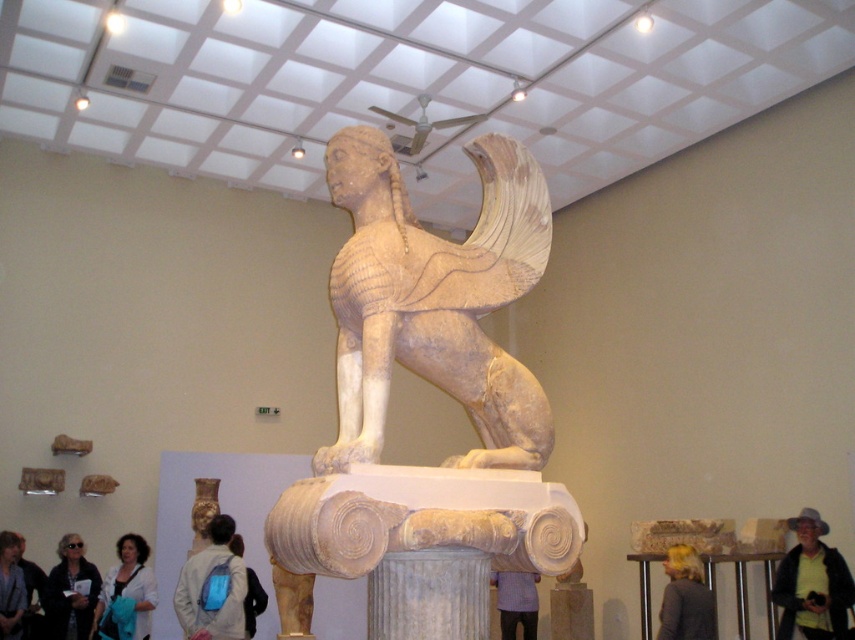
You are a visitor in the museum and notice two shirts in the image. The matte white shirt at lower left and the purple fabric shirt at center. Which shirt is covering part of the other?

The matte white shirt at lower left is positioned over the purple fabric shirt at center, so it is covering part of it.

You are an art student observing the sculpture and notice two shirts in the image. Which shirt, the matte white shirt at lower left or the purple fabric shirt at center, is closer to you?

The matte white shirt at lower left is closer to you because it is in front of the purple fabric shirt at center.